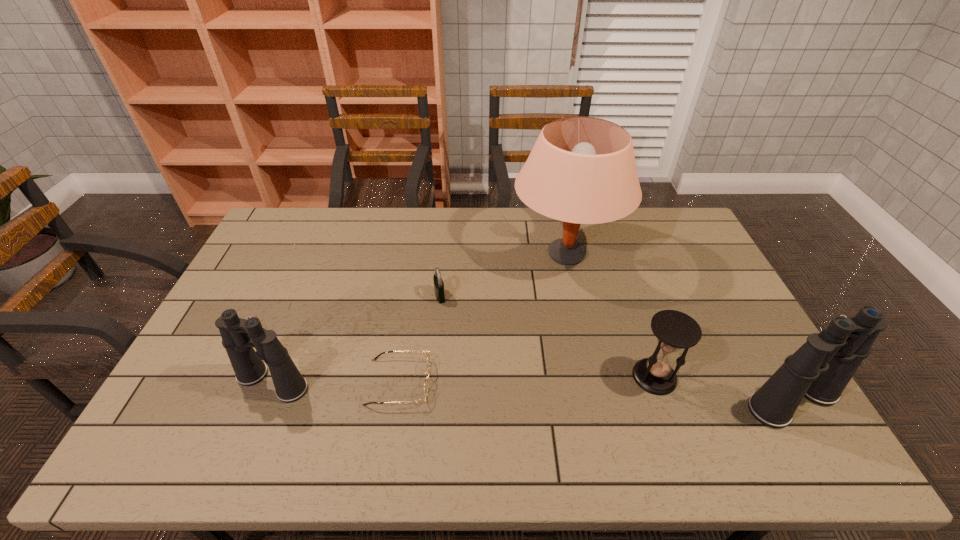
Locate an element on the screen. blank area located on the right of the second shortest object is located at coordinates (492, 295).

This screenshot has width=960, height=540. I want to click on blank area located on the front-facing side of the lampshade, so click(403, 254).

The image size is (960, 540). What are the coordinates of `vacant space situated on the front-facing side of the lampshade` in the screenshot? It's located at (400, 254).

This screenshot has height=540, width=960. I want to click on free location located on the front-facing side of the lampshade, so (x=440, y=254).

I want to click on vacant space located 0.210m on the lenses of the spectacles, so click(x=510, y=382).

You are a GUI agent. You are given a task and a screenshot of the screen. Output one action in this format:
    pyautogui.click(x=<x>, y=<y>)
    Task: Click on the vacant space located on the right of the fourth tallest object
    
    Given the screenshot: What is the action you would take?
    pyautogui.click(x=743, y=377)

Find the location of a particular element. The width and height of the screenshot is (960, 540). object that is at the far edge is located at coordinates (581, 170).

Locate an element on the screen. This screenshot has width=960, height=540. spectacles present at the near edge is located at coordinates (425, 382).

Find the location of a particular element. This screenshot has width=960, height=540. hourglass that is at the near edge is located at coordinates (675, 330).

Locate an element on the screen. The image size is (960, 540). object at the left edge is located at coordinates (239, 336).